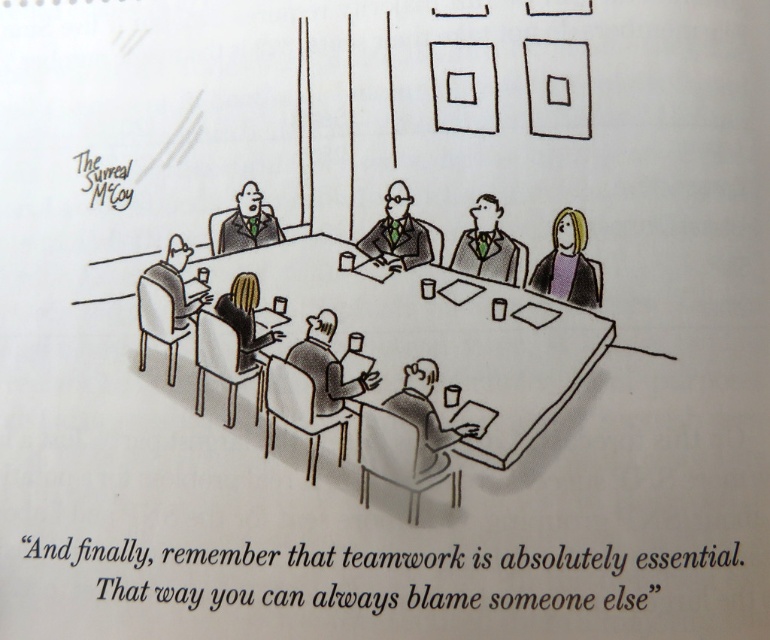
Which is in front, point (521, 253) or point (243, 337)?

Point (243, 337) is in front.

Who is lower down, smooth gray suit at center or black hair at center?

black hair at center

Between point (460, 250) and point (235, 289), which one is positioned behind?

The point (460, 250) is behind.

Where is `smooth gray suit at center`? smooth gray suit at center is located at coordinates (489, 246).

Which of these two, smooth gray suit at center or matte black chair at left, stands shorter?

smooth gray suit at center is shorter.

Which is behind, point (464, 240) or point (203, 280)?

Point (203, 280)

Which is behind, point (486, 196) or point (176, 323)?

The point (176, 323) is more distant.

The height and width of the screenshot is (640, 770). Find the location of `smooth gray suit at center`. smooth gray suit at center is located at coordinates (489, 246).

Which is behind, point (417, 362) or point (161, 278)?

The point (161, 278) is more distant.

Is point (407, 408) more distant than point (183, 252)?

No, (407, 408) is in front of (183, 252).

The height and width of the screenshot is (640, 770). Describe the element at coordinates (427, 419) in the screenshot. I see `smooth gray suit at lower center` at that location.

I want to click on smooth gray suit at lower center, so click(x=427, y=419).